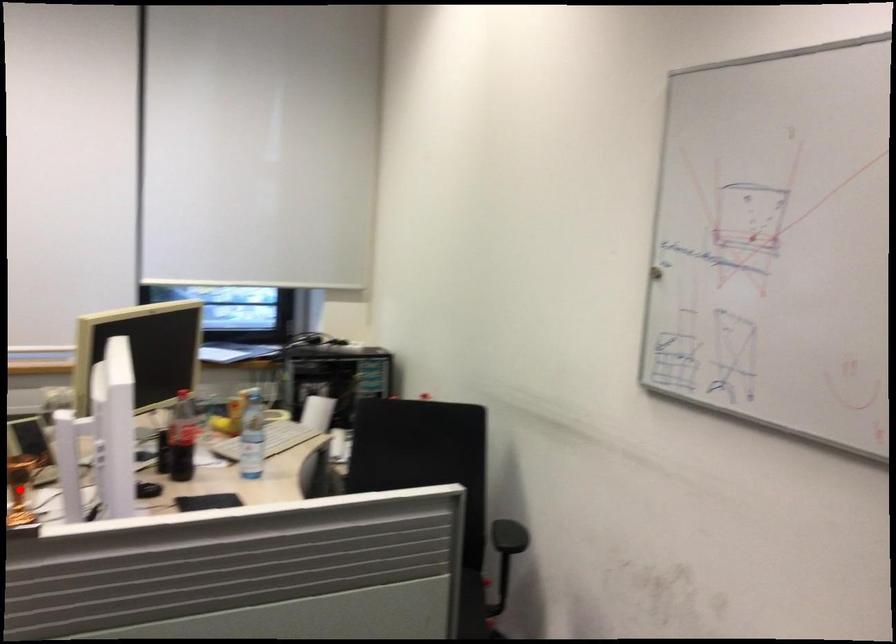
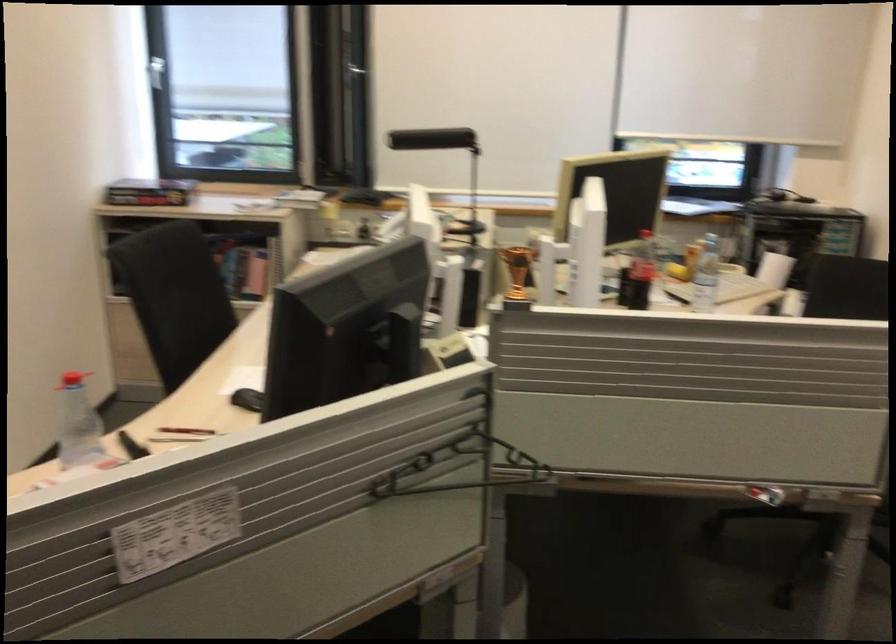
Question: I am providing you with two images of the same scene from different viewpoints. Image1 has a red point marked. In image2, the corresponding 3D location appears at what relative position? Reply with the corresponding letter.

Choices:
 (A) Closer
 (B) Farther

Answer: (A)